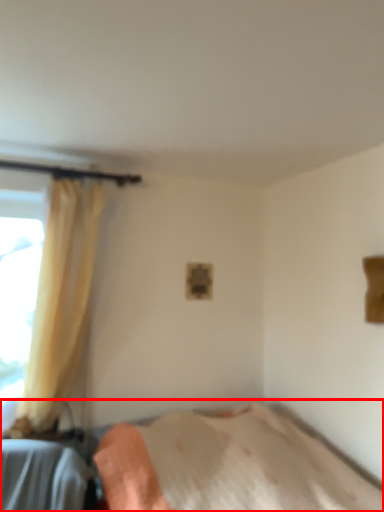
Question: From the image's perspective, what is the correct spatial relationship of bed (annotated by the red box) in relation to curtain?

Choices:
 (A) above
 (B) below

Answer: (B)